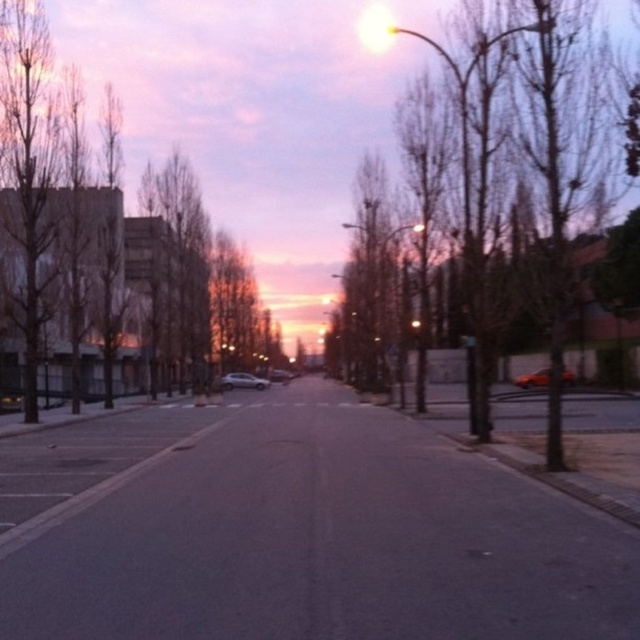
You are a delivery driver who needs to park your metallic orange car at center and your satin silver sedan at center in a parking lot with limited space. Based on the scene, which car requires more space to park?

The metallic orange car at center is bigger than the satin silver sedan at center, so it requires more space to park.

You are a driver approaching the satin silver sedan at center parked on a quiet urban street. There is a brown leafless tree at left nearby. If you need to pass the sedan safely, which object should you avoid hitting based on their sizes?

The brown leafless tree at left is taller than the satin silver sedan at center, so you should avoid hitting the brown leafless tree at left since it is taller and could pose a greater risk of collision.

You are driving a metallic orange car at center and want to safely merge into the lane where the satin silver sedan at center is driving. Based on their positions, which direction should you turn your car to align with the sedan?

You should turn your car to the left to align with the satin silver sedan at center because the metallic orange car at center is positioned to the right of the sedan.